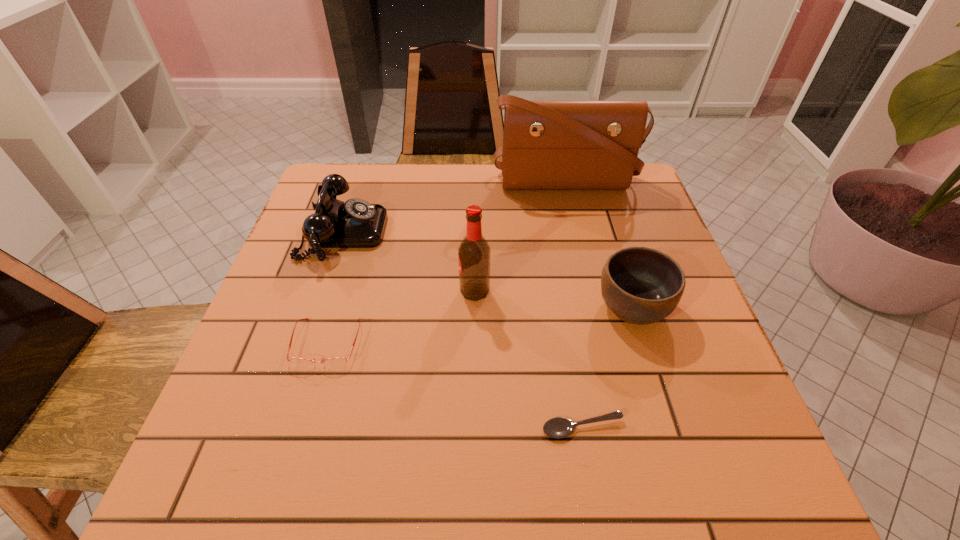
At what (x,y) coordinates should I click in order to perform the action: click on object that can be found as the third closest to the bowl. Please return your answer as a coordinate pair (x, y). Looking at the image, I should click on (547, 144).

Locate which object is the closest to the telephone. Please provide its 2D coordinates. Your answer should be formatted as a tuple, i.e. [(x, y)], where the tuple contains the x and y coordinates of a point satisfying the conditions above.

[(338, 361)]

Locate an element on the screen. vacant point that satisfies the following two spatial constraints: 1. on the dial of the telephone; 2. on the back side of the bowl is located at coordinates (319, 308).

I want to click on vacant region that satisfies the following two spatial constraints: 1. on the front flap of the bowl; 2. on the left side of the farthest object, so click(x=594, y=308).

This screenshot has width=960, height=540. Find the location of `vacant space that satisfies the following two spatial constraints: 1. on the front flap of the tallest object; 2. on the dial of the telephone`. vacant space that satisfies the following two spatial constraints: 1. on the front flap of the tallest object; 2. on the dial of the telephone is located at coordinates (576, 232).

Find the location of a particular element. This screenshot has width=960, height=540. free space that satisfies the following two spatial constraints: 1. on the dial of the telephone; 2. on the back side of the soupspoon is located at coordinates (278, 428).

Locate an element on the screen. The image size is (960, 540). vacant area in the image that satisfies the following two spatial constraints: 1. on the dial of the bowl; 2. on the right side of the telephone is located at coordinates (319, 308).

Where is `free space that satisfies the following two spatial constraints: 1. on the front side of the bowl; 2. on the left side of the beer bottle`? This screenshot has height=540, width=960. free space that satisfies the following two spatial constraints: 1. on the front side of the bowl; 2. on the left side of the beer bottle is located at coordinates (474, 308).